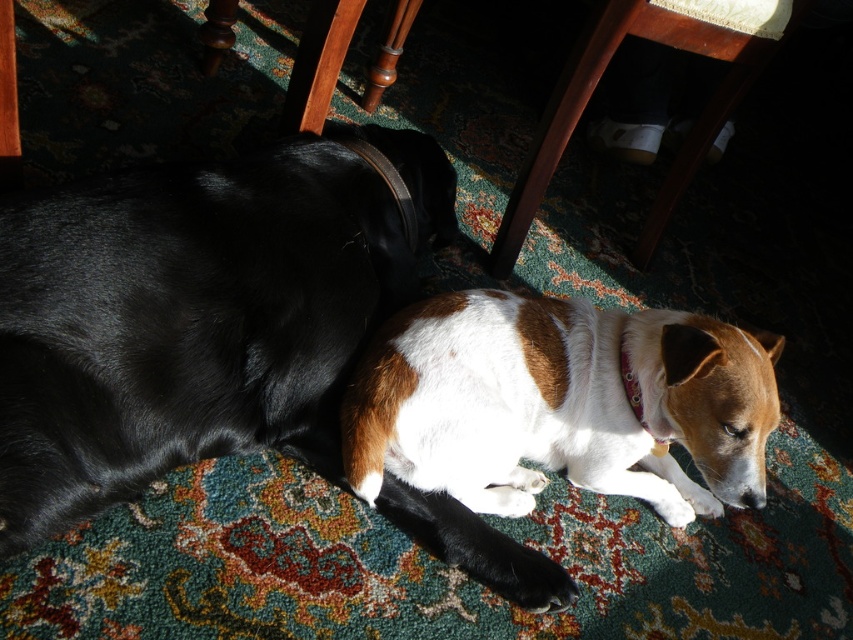
Question: Estimate the real-world distances between objects in this image. Which object is farther from the wooden chair leg at lower center?

Choices:
 (A) brown/white fur dog at lower right
 (B) pink fabric neckband at lower center
 (C) brown/white fur dog at center

Answer: (A)

Question: Considering the relative positions of wooden chair leg at lower center and leather at center in the image provided, where is wooden chair leg at lower center located with respect to leather at center?

Choices:
 (A) right
 (B) left

Answer: (A)

Question: Based on their relative distances, which object is farther from the leather at center?

Choices:
 (A) brown/white fur dog at center
 (B) brown/white fur dog at lower right
 (C) wooden chair leg at lower center
 (D) pink fabric neckband at lower center

Answer: (D)

Question: Is brown/white fur dog at center positioned in front of wooden chair leg at lower center?

Choices:
 (A) no
 (B) yes

Answer: (B)

Question: Which object appears closest to the camera in this image?

Choices:
 (A) brown/white fur dog at center
 (B) wooden chair leg at lower center
 (C) brown/white fur dog at lower right
 (D) pink fabric neckband at lower center

Answer: (C)

Question: Can you confirm if brown/white fur dog at center is positioned above leather at center?

Choices:
 (A) yes
 (B) no

Answer: (B)